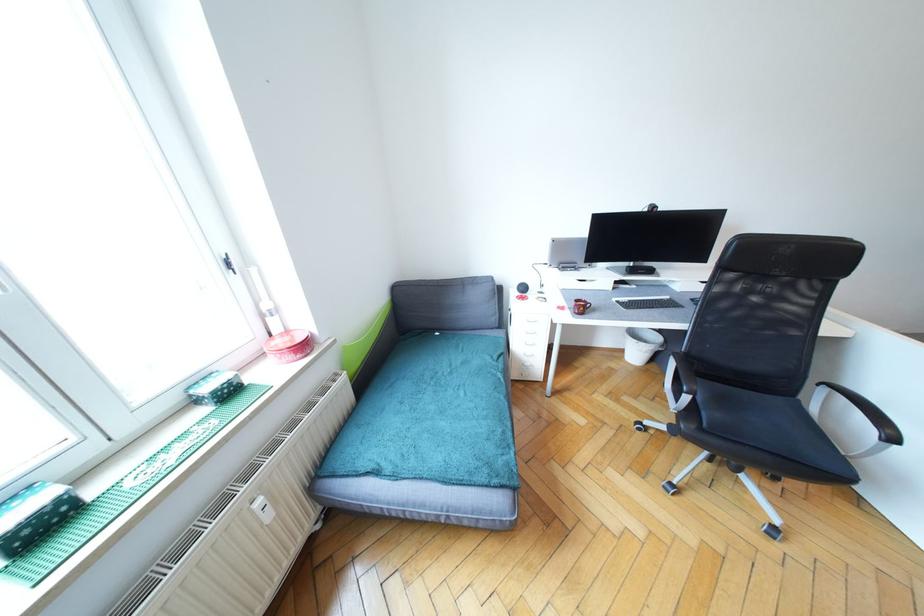
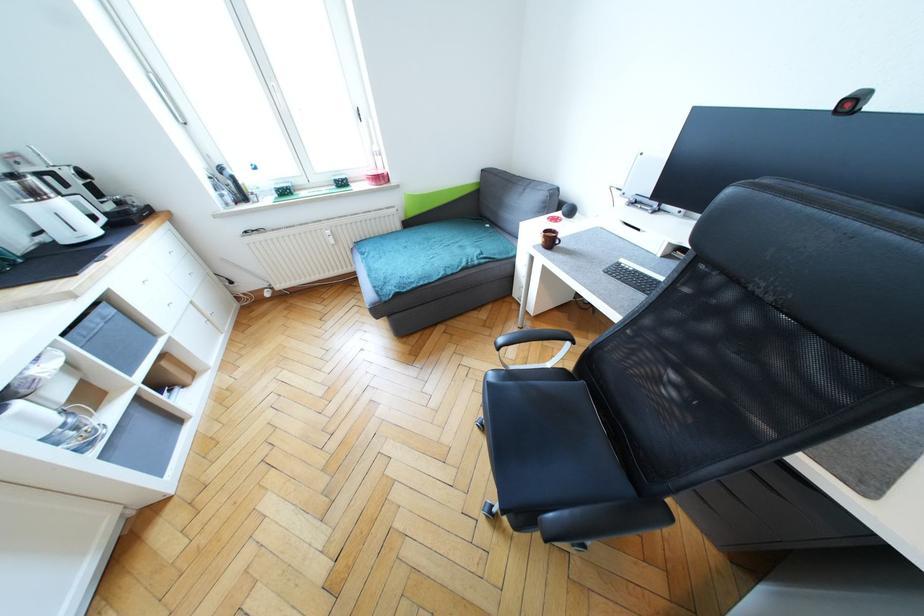
Locate, in the second image, the point that corresponds to pixel 589 302 in the first image.

(558, 235)